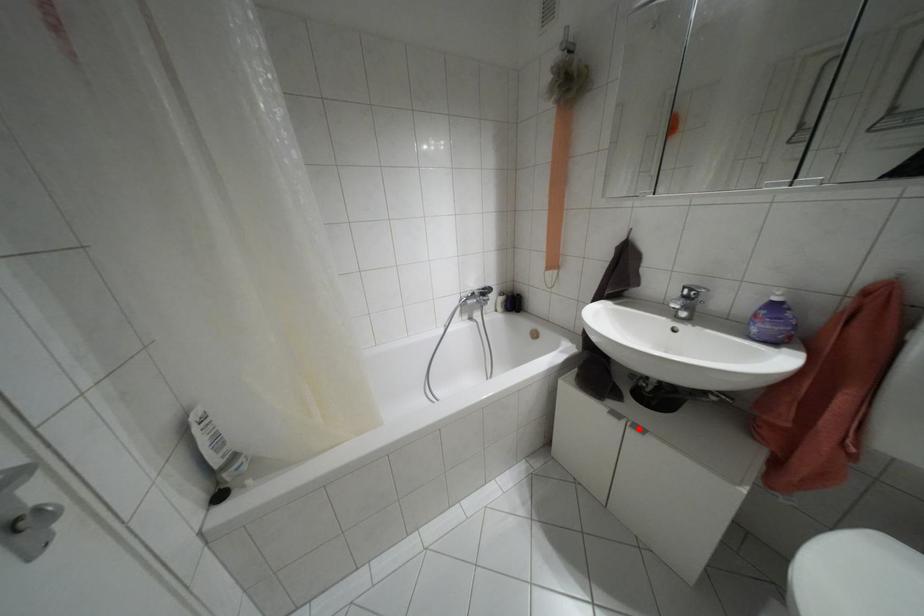
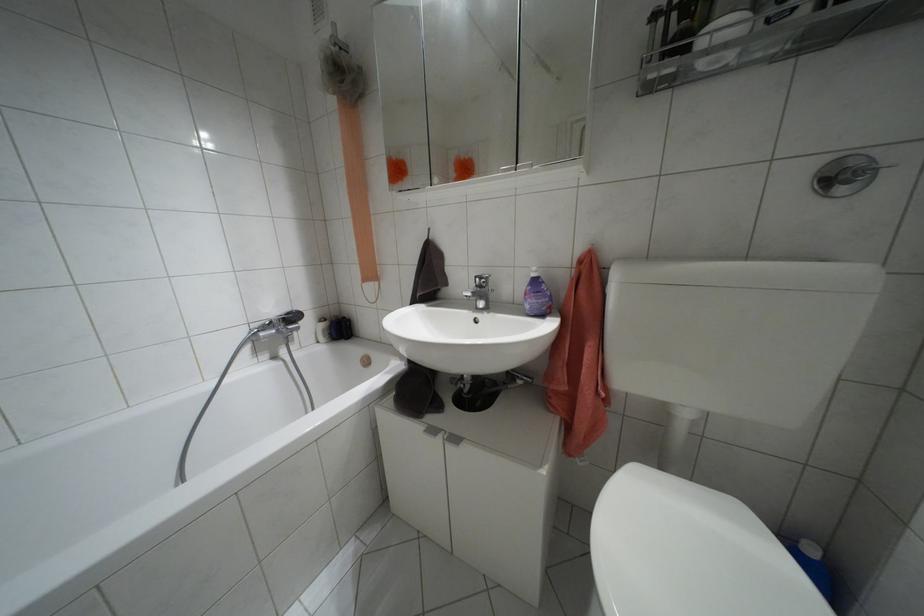
In the second image, find the point that corresponds to the highlighted location in the first image.

(455, 439)